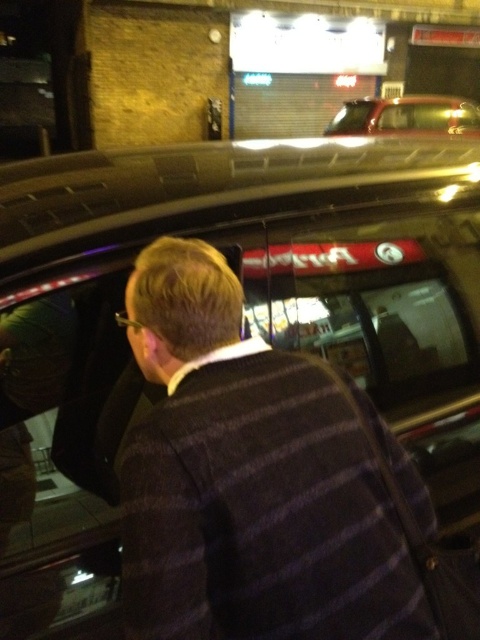
Consider the image. Who is positioned more to the right, dark striped sweater at center or metallic gold car at upper center?

Positioned to the right is metallic gold car at upper center.

Does point (300, 534) come farther from viewer compared to point (344, 122)?

No, it is not.

The height and width of the screenshot is (640, 480). Find the location of `dark striped sweater at center`. dark striped sweater at center is located at coordinates (249, 481).